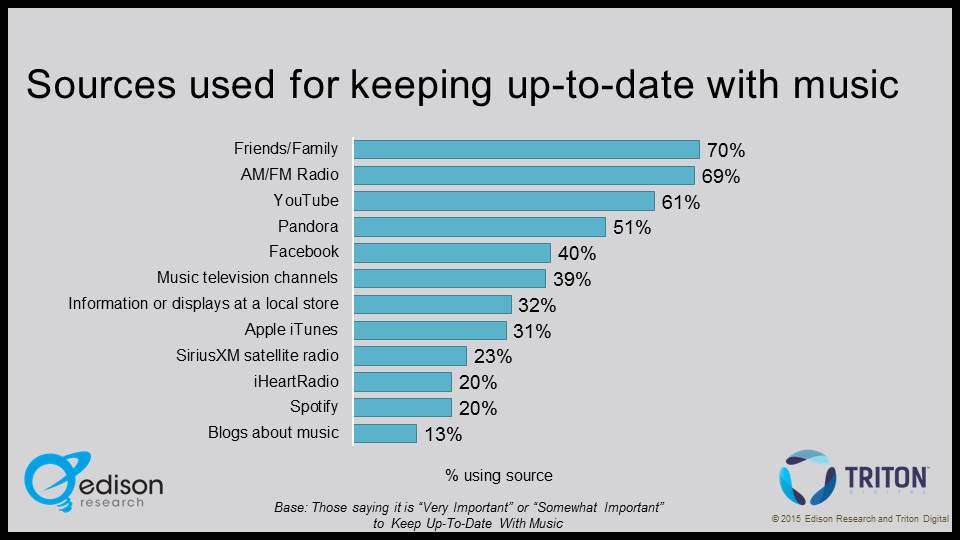
Where is `music source`? Image resolution: width=960 pixels, height=540 pixels. music source is located at coordinates (272, 381), (277, 354), (277, 328), (309, 407), (312, 195), (305, 229), (285, 172), (252, 280).